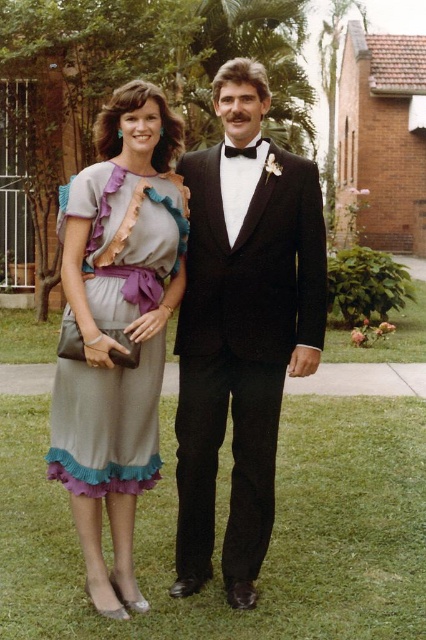
Question: Which point appears closest to the camera in this image?

Choices:
 (A) (256, 260)
 (B) (224, 154)
 (C) (132, 193)

Answer: (C)

Question: Which object is closer to the camera taking this photo?

Choices:
 (A) black satin tuxedo at center
 (B) matte gray dress with ruffled trim at center

Answer: (B)

Question: Is black satin tuxedo at center further to camera compared to black satin bow tie at center?

Choices:
 (A) yes
 (B) no

Answer: (B)

Question: Is matte gray dress with ruffled trim at center below black satin bow tie at center?

Choices:
 (A) yes
 (B) no

Answer: (A)

Question: Does matte gray dress with ruffled trim at center have a smaller size compared to black satin bow tie at center?

Choices:
 (A) yes
 (B) no

Answer: (B)

Question: Which of the following is the closest to the observer?

Choices:
 (A) (313, 253)
 (B) (143, 259)
 (C) (253, 150)

Answer: (B)